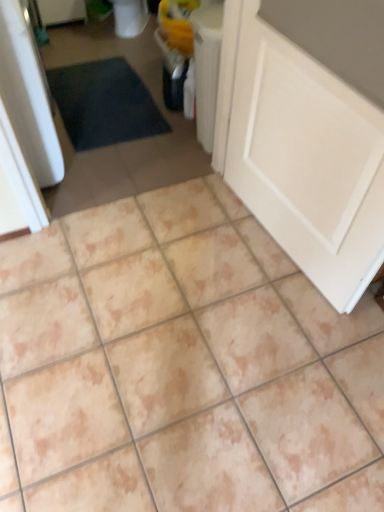
Question: Looking at their shapes, would you say white matte door at lower right is wider or thinner than beige ceramic tile at center?

Choices:
 (A) wide
 (B) thin

Answer: (B)

Question: Looking at the image, does white matte door at lower right seem bigger or smaller compared to beige ceramic tile at center?

Choices:
 (A) big
 (B) small

Answer: (B)

Question: Relative to beige ceramic tile at center, is white matte door at lower right in front or behind?

Choices:
 (A) behind
 (B) front

Answer: (B)

Question: From the image's perspective, is beige ceramic tile at center positioned above or below white matte door at lower right?

Choices:
 (A) below
 (B) above

Answer: (B)

Question: Is beige ceramic tile at center taller or shorter than white matte door at lower right?

Choices:
 (A) short
 (B) tall

Answer: (A)

Question: Considering the relative positions of beige ceramic tile at center and white matte door at lower right in the image provided, is beige ceramic tile at center to the left or to the right of white matte door at lower right?

Choices:
 (A) left
 (B) right

Answer: (A)

Question: Is beige ceramic tile at center bigger or smaller than white matte door at lower right?

Choices:
 (A) big
 (B) small

Answer: (A)